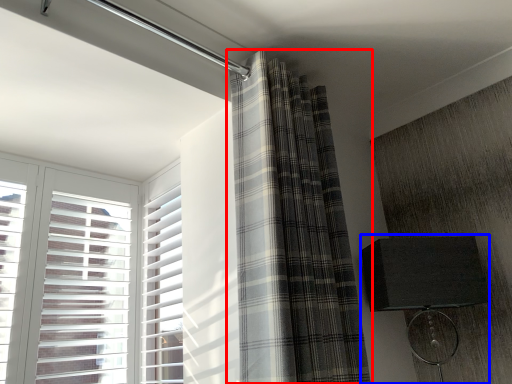
Question: Which object is closer to the camera taking this photo, curtain (highlighted by a red box) or table lamp (highlighted by a blue box)?

Choices:
 (A) curtain
 (B) table lamp

Answer: (A)